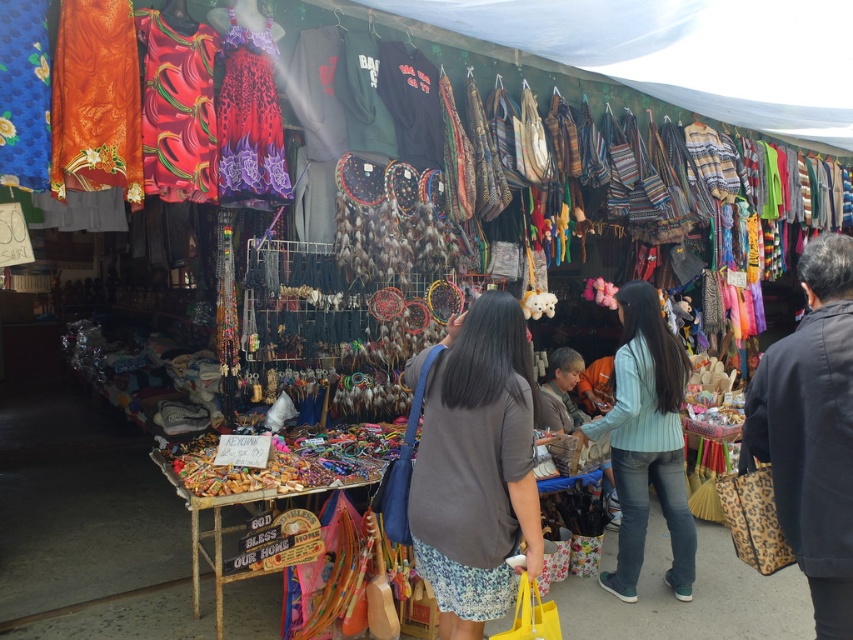
You are standing in front of the market stall and want to locate two specific points marked in the image. The first point is at coordinates point (461, 513) and the second is at point (650, 396). Which of these points is closer to you?

Point (461, 513) is closer to the viewer than point (650, 396).